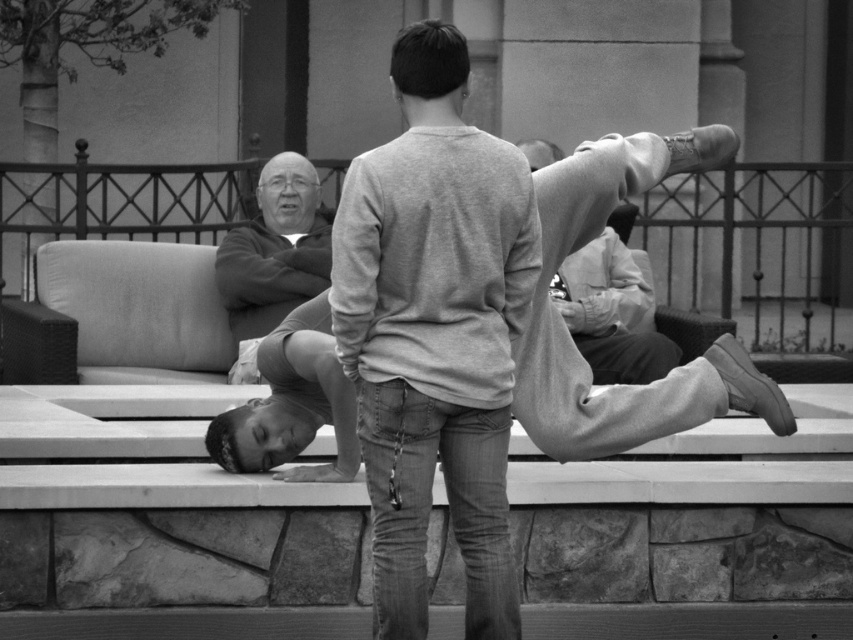
You are a photographer trying to capture a candid shot of the man in the scene. You notice the smooth gray sweater at upper center and the smooth gray pants at center. Which object is positioned higher in the frame?

The smooth gray sweater at upper center is positioned higher in the frame than the smooth gray pants at center.

You are a photographer trying to capture a closeup of the smooth gray sweater at upper center without including the smooth gray pants at center in the frame. Is this possible based on their positions?

Yes, the smooth gray sweater at upper center is positioned closer to the viewer than the smooth gray pants at center, so adjusting the camera angle downward could isolate the sweater while excluding the pants.

You are a photographer trying to capture a detailed shot of the smooth gray sweater at upper center and the smooth gray pants at center. Which object should you zoom in on to ensure it takes up more of the frame without moving the camera?

The smooth gray sweater at upper center has a smaller size compared to smooth gray pants at center, so you should zoom in on the smooth gray pants at center to ensure it takes up more of the frame without moving the camera.